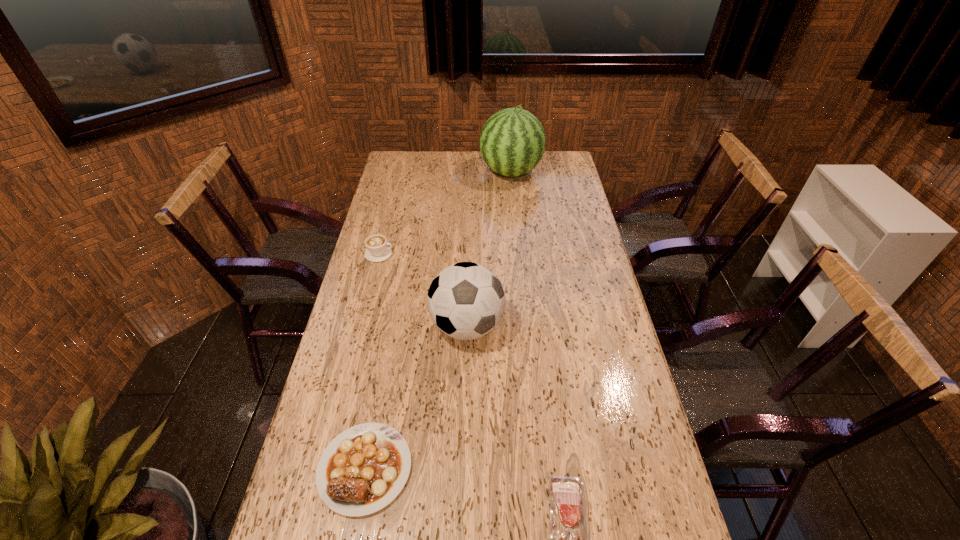
The height and width of the screenshot is (540, 960). Identify the location of the tallest object. (512, 142).

The image size is (960, 540). Find the location of `the farthest object`. the farthest object is located at coordinates (512, 142).

At what (x,y) coordinates should I click in order to perform the action: click on soccer ball. Please return your answer as a coordinate pair (x, y). The width and height of the screenshot is (960, 540). Looking at the image, I should click on (466, 301).

This screenshot has width=960, height=540. What are the coordinates of `the fourth shortest object` in the screenshot? It's located at (466, 301).

Where is `cappuccino`? The image size is (960, 540). cappuccino is located at coordinates (377, 250).

At what (x,y) coordinates should I click in order to perform the action: click on the second farthest object. Please return your answer as a coordinate pair (x, y). Looking at the image, I should click on (377, 250).

This screenshot has height=540, width=960. In order to click on the left steak in this screenshot , I will do `click(363, 469)`.

Where is `the taller steak`? the taller steak is located at coordinates (363, 469).

Locate an element on the screen. This screenshot has height=540, width=960. blank area located on the left of the tallest object is located at coordinates (400, 172).

Find the location of a particular element. This screenshot has width=960, height=540. free space located 0.310m on the main logo of the soccer ball is located at coordinates (464, 459).